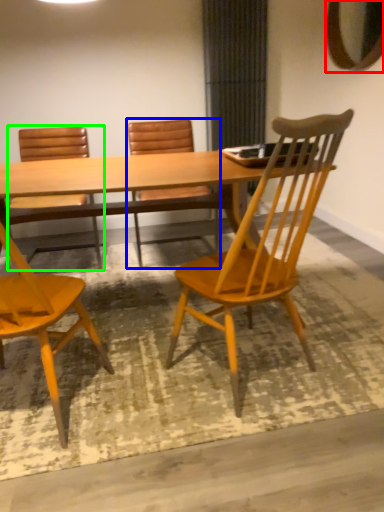
Question: Estimate the real-world distances between objects in this image. Which object is closer to mirror (highlighted by a red box), chair (highlighted by a blue box) or chair (highlighted by a green box)?

Choices:
 (A) chair
 (B) chair

Answer: (A)